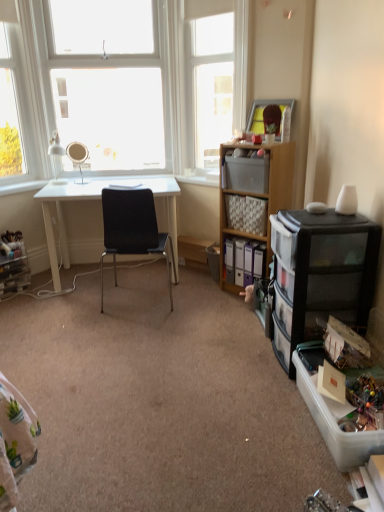
At what (x,y) coordinates should I click in order to perform the action: click on vacant region to the right of matte silver mirror at upper left. Please return your answer as a coordinate pair (x, y). Looking at the image, I should click on (100, 182).